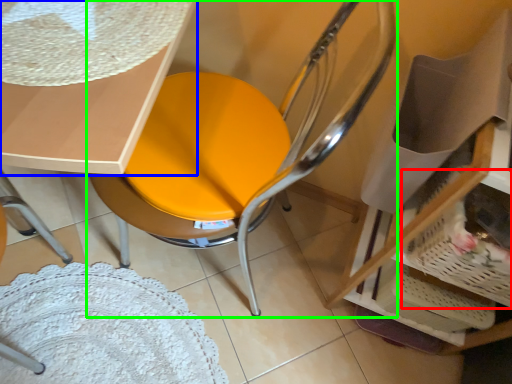
Question: Which object is the closest to the basket (highlighted by a red box)? Choose among these: table (highlighted by a blue box) or chair (highlighted by a green box).

Choices:
 (A) table
 (B) chair

Answer: (B)